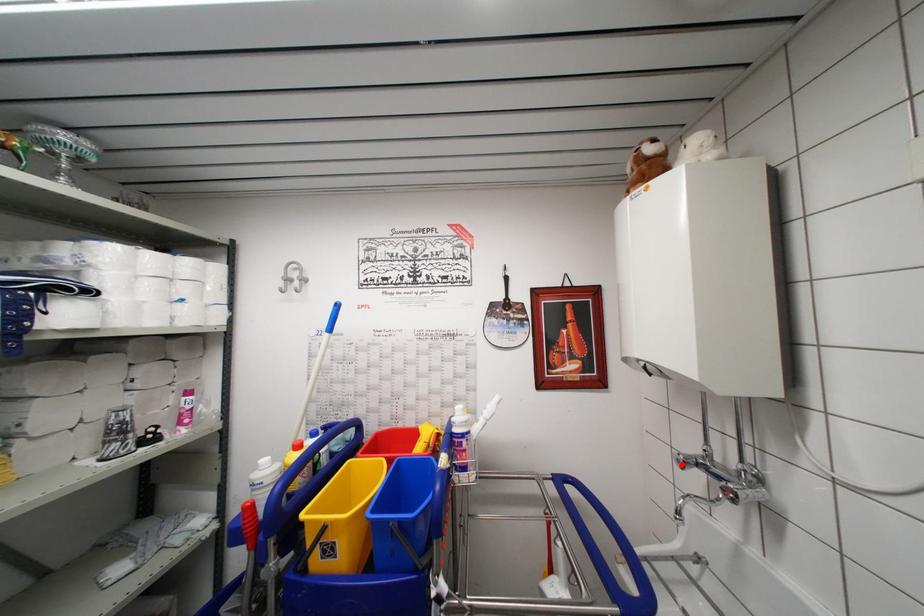
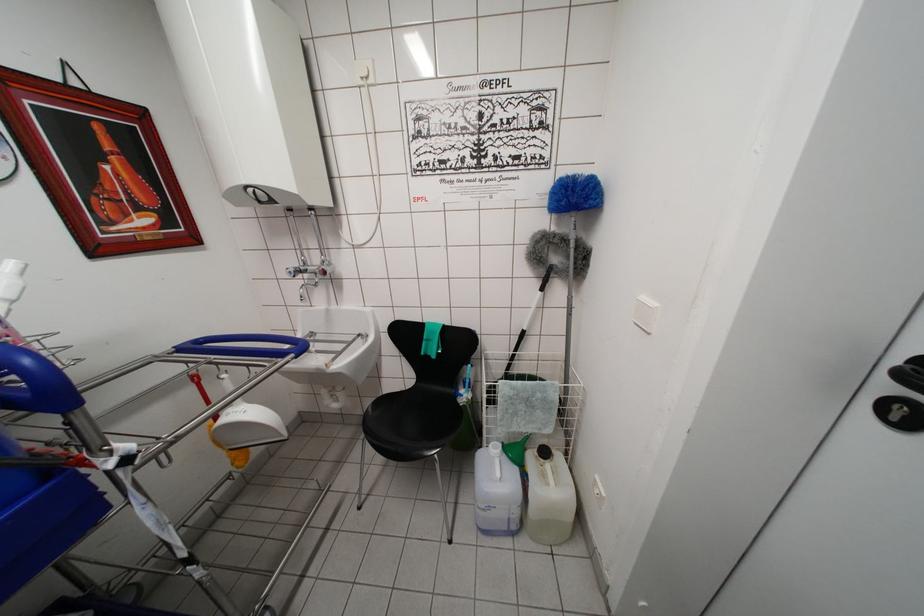
Locate, in the second image, the point that corresponds to the highlighted location in the first image.

(293, 277)